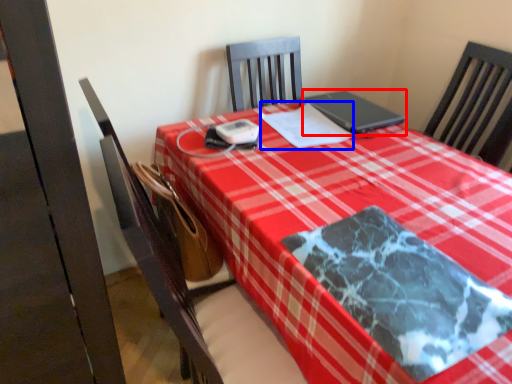
Question: Which point is closer to the camera, laptop (highlighted by a red box) or notebook (highlighted by a blue box)?

Choices:
 (A) laptop
 (B) notebook

Answer: (B)